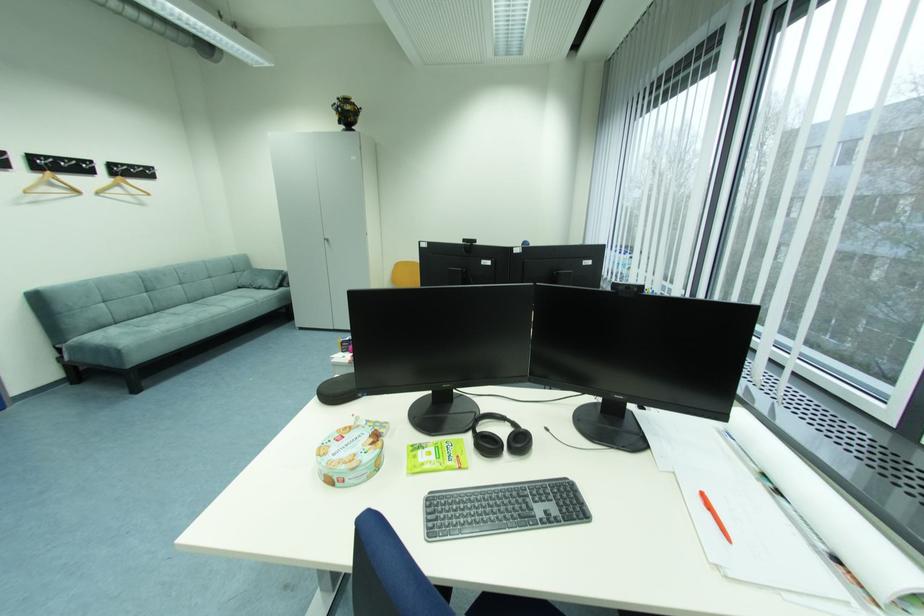
Where would you pull the cabinet door handle? Please return your answer as a coordinate pair (x, y).

(326, 241)